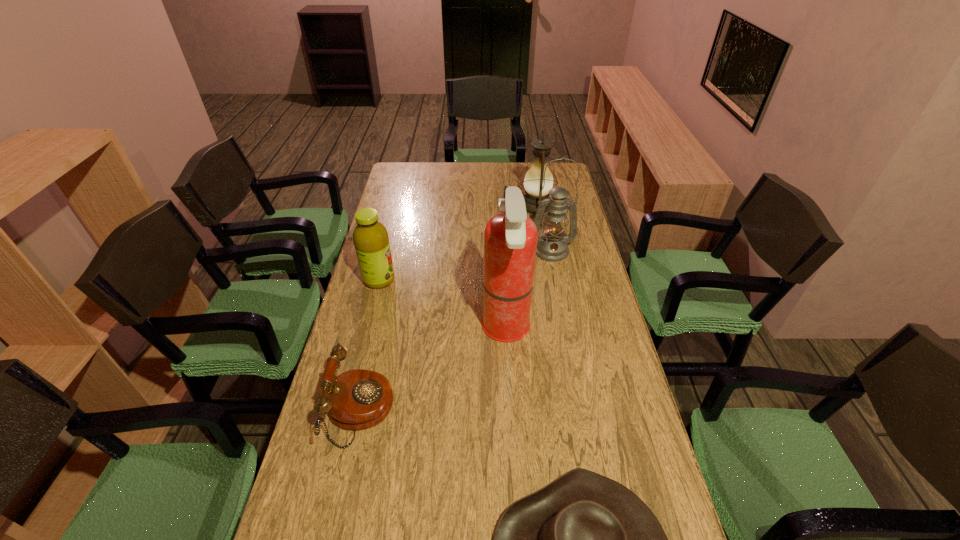
You are a GUI agent. You are given a task and a screenshot of the screen. Output one action in this format:
    pyautogui.click(x=<x>, y=<y>)
    Task: Click on the tallest object
    
    Given the screenshot: What is the action you would take?
    pyautogui.click(x=510, y=239)

I want to click on fire extinguisher, so click(x=510, y=239).

Identify the location of the fifth nearest object. (552, 246).

This screenshot has height=540, width=960. I want to click on the farther oil lamp, so click(534, 179).

You are a GUI agent. You are given a task and a screenshot of the screen. Output one action in this format:
    pyautogui.click(x=<x>, y=<y>)
    Task: Click on the fourth tallest object
    
    Given the screenshot: What is the action you would take?
    pyautogui.click(x=370, y=237)

Image resolution: width=960 pixels, height=540 pixels. I want to click on the fourth nearest object, so click(370, 237).

Locate an element on the screen. The width and height of the screenshot is (960, 540). the fifth tallest object is located at coordinates (357, 399).

I want to click on telephone, so click(357, 399).

Identify the location of free location located with the handle and hose on the third nearest object. The image size is (960, 540). (397, 329).

At what (x,y) coordinates should I click in order to perform the action: click on vacant region located with the handle and hose on the third nearest object. Please return your answer as a coordinate pair (x, y). The height and width of the screenshot is (540, 960). Looking at the image, I should click on tap(438, 329).